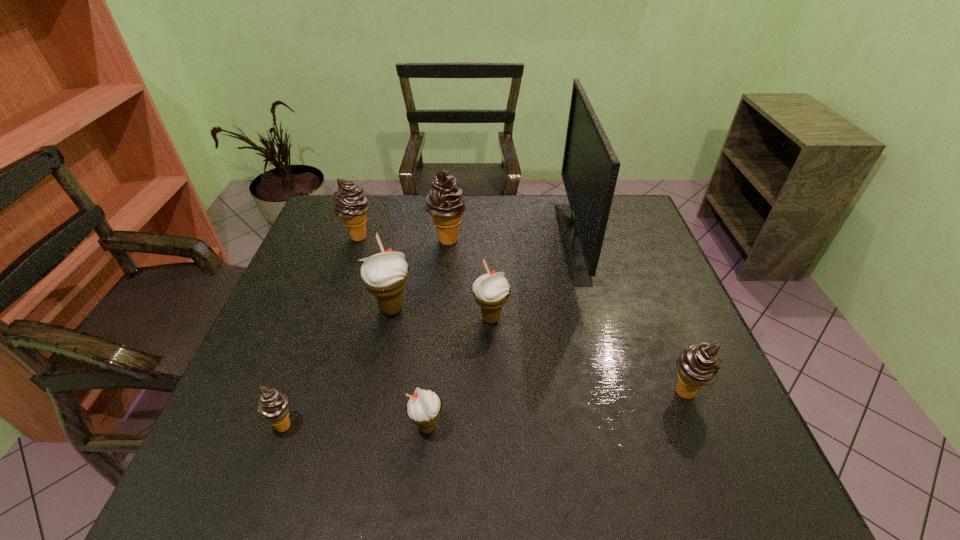
Identify the location of vacant space at the right edge of the desktop. The height and width of the screenshot is (540, 960). (628, 266).

Identify the location of free space at the far left corner of the desktop. This screenshot has width=960, height=540. [x=329, y=229].

This screenshot has height=540, width=960. What are the coordinates of `vacant space at the far right corner of the desktop` in the screenshot? It's located at (626, 219).

The height and width of the screenshot is (540, 960). What are the coordinates of `free space that is in between the biggest chocolate icecream and the third smallest chocolate icecream` in the screenshot? It's located at (403, 239).

Locate an element on the screen. The image size is (960, 540). free space between the third smallest chocolate icecream and the second chocolate icecream from right to left is located at coordinates (403, 239).

The image size is (960, 540). In order to click on unoccupied position between the third object from right to left and the tallest object in this screenshot , I will do `click(531, 280)`.

Locate an element on the screen. Image resolution: width=960 pixels, height=540 pixels. free space between the nearest chocolate icecream and the monitor is located at coordinates (427, 333).

Locate an element on the screen. free space that is in between the monitor and the second smallest chocolate icecream is located at coordinates (629, 317).

Locate an element on the screen. vacant space that's between the second icecream from right to left and the fifth farthest icecream is located at coordinates (588, 356).

Where is `blank region between the third object from right to left and the sixth object from right to left`? This screenshot has width=960, height=540. blank region between the third object from right to left and the sixth object from right to left is located at coordinates (442, 314).